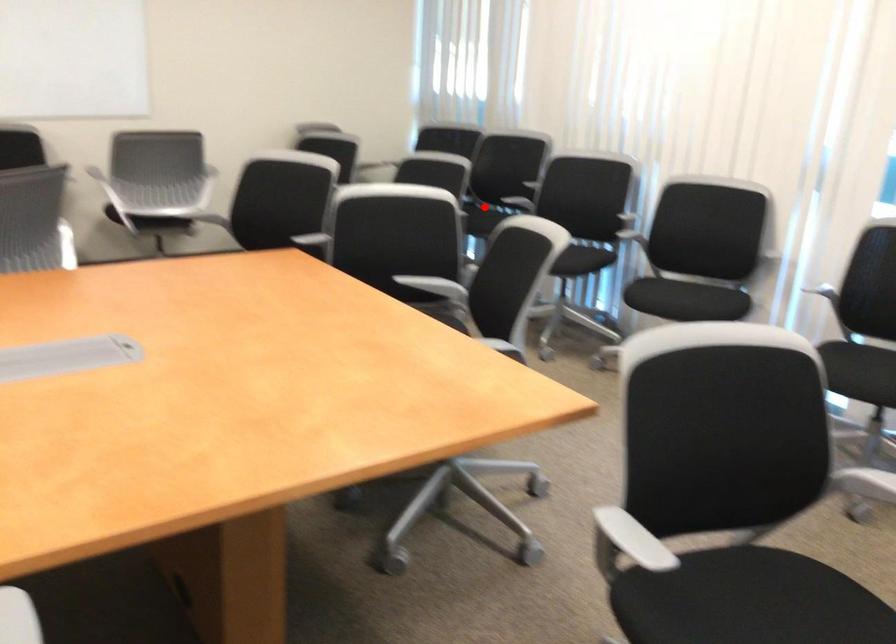
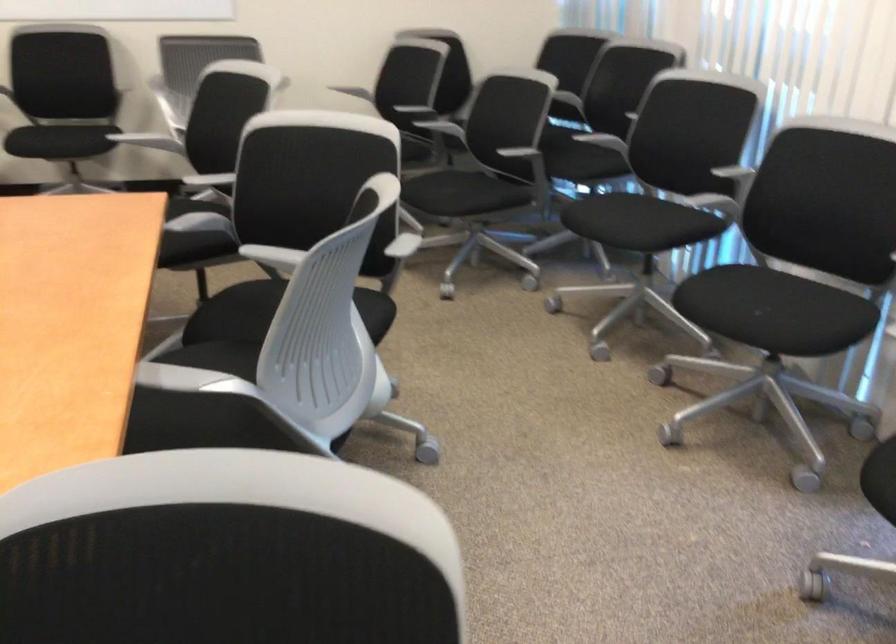
In the second image, find the point that corresponds to the highlighted location in the first image.

(588, 147)